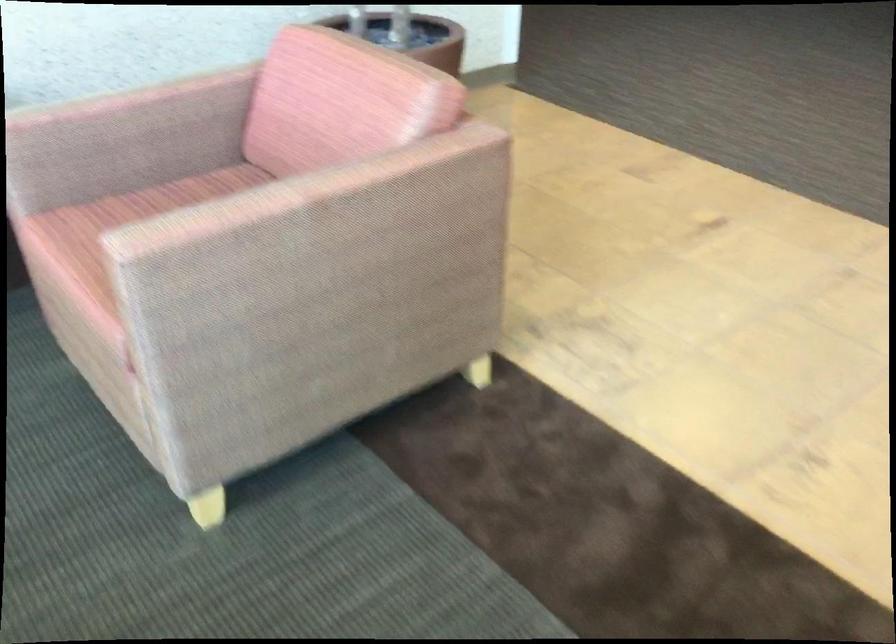
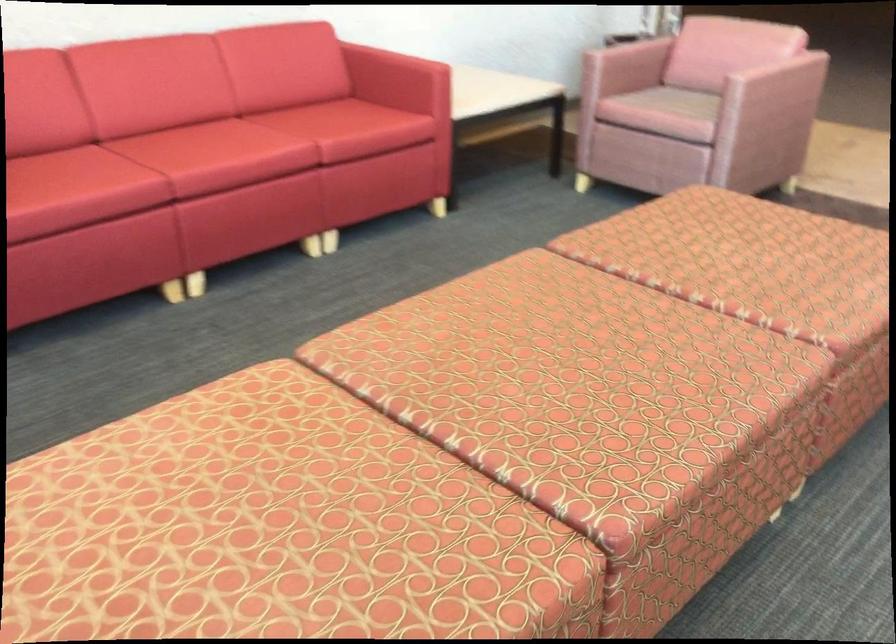
Locate, in the second image, the point that corresponds to point 134,122 in the first image.

(627, 58)